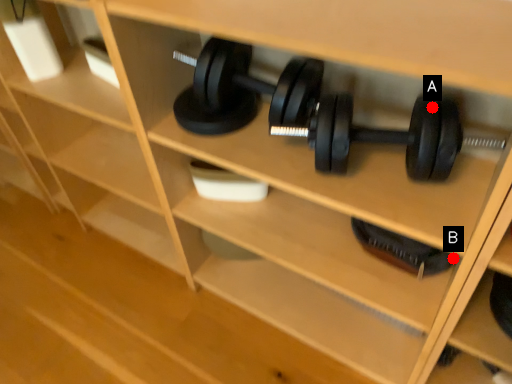
Question: Two points are circled on the image, labeled by A and B beside each circle. Among these points, which one is farthest from the camera?

Choices:
 (A) A is further
 (B) B is further

Answer: (B)